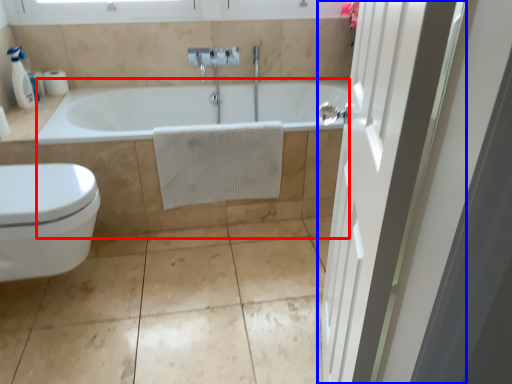
Question: Which object appears farthest to the camera in this image, bath (highlighted by a red box) or door (highlighted by a blue box)?

Choices:
 (A) bath
 (B) door

Answer: (A)